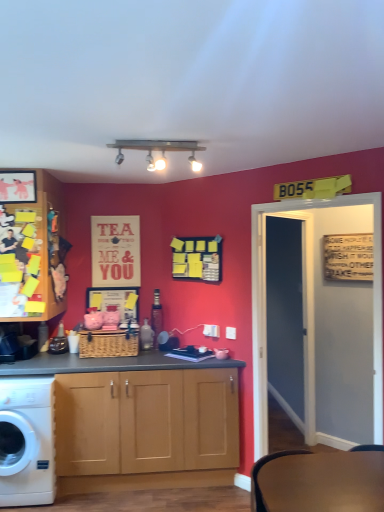
At what (x,y) coordinates should I click in order to perform the action: click on free point above metallic track lighting at upper center (from a real-world perspective). Please return your answer as a coordinate pair (x, y). This screenshot has width=384, height=512. Looking at the image, I should click on (165, 139).